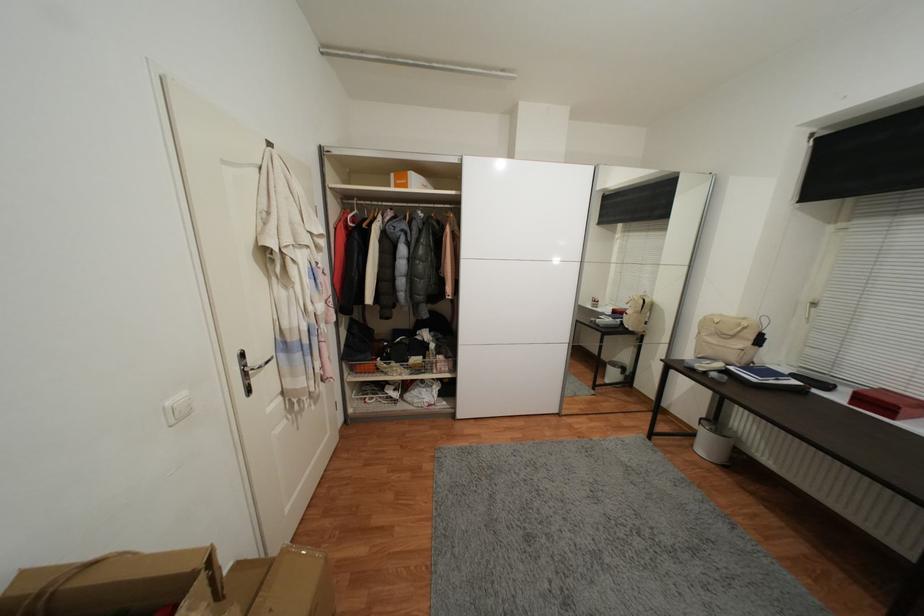
Find where to lift the beige backpack. Please return your answer as a coordinate pair (x, y).

(728, 339)